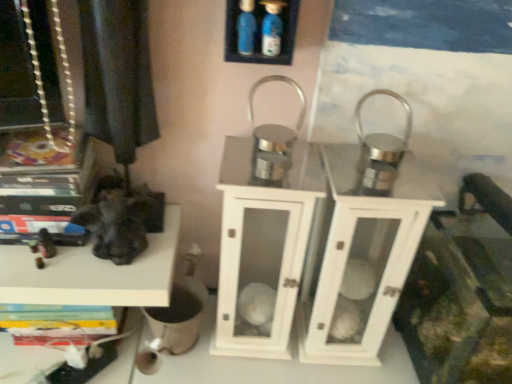
The height and width of the screenshot is (384, 512). What do you see at coordinates (260, 34) in the screenshot? I see `blue plastic bottles at upper center, which is the 2th shelf in bottom-to-top order` at bounding box center [260, 34].

The height and width of the screenshot is (384, 512). In order to click on blue plastic bottles at upper center, acting as the 2th shelf starting from the left in this screenshot , I will do `click(260, 34)`.

Considering the sizes of objects black matte statue at left, which is the first shelf from bottom to top, and white glossy lantern at center in the image provided, who is bigger, black matte statue at left, which is the first shelf from bottom to top, or white glossy lantern at center?

white glossy lantern at center.

What's the angular difference between black matte statue at left, which is the first shelf from bottom to top, and white glossy lantern at center's facing directions?

0.0246 degrees separate the facing orientations of black matte statue at left, which is the first shelf from bottom to top, and white glossy lantern at center.

Would you say white glossy lantern at center is part of black matte statue at left, which ranks as the second shelf in top-to-bottom order,'s contents?

Actually, white glossy lantern at center is outside black matte statue at left, which ranks as the second shelf in top-to-bottom order.

Is point (306, 320) positioned after point (286, 22)?

Yes, it is behind point (286, 22).

Based on their positions, is white glossy lantern at center located to the left or right of blue plastic bottles at upper center, the second shelf when ordered from back to front?

white glossy lantern at center is to the right of blue plastic bottles at upper center, the second shelf when ordered from back to front.

Is blue plastic bottles at upper center, which is the 2th shelf in bottom-to-top order, completely or partially inside white glossy lantern at center?

No, blue plastic bottles at upper center, which is the 2th shelf in bottom-to-top order, is located outside of white glossy lantern at center.

Can you confirm if blue plastic bottles at upper center, acting as the 2th shelf starting from the left, is shorter than white glossy lantern at center?

Indeed, blue plastic bottles at upper center, acting as the 2th shelf starting from the left, has a lesser height compared to white glossy lantern at center.

Does point (257, 53) appear closer or farther from the camera than point (385, 307)?

Clearly, point (257, 53) is closer to the camera than point (385, 307).

At what (x,y) coordinates should I click in order to perform the action: click on shelf above the white glossy lantern at center (from a real-world perspective). Please return your answer as a coordinate pair (x, y). The height and width of the screenshot is (384, 512). Looking at the image, I should click on (260, 34).

Measure the distance between blue plastic bottles at upper center, acting as the 2th shelf starting from the left, and white glossy lantern at center.

blue plastic bottles at upper center, acting as the 2th shelf starting from the left, is 16.22 inches from white glossy lantern at center.

From the image's perspective, between blue plastic bottles at upper center, acting as the 2th shelf starting from the left, and black matte statue at left, the second shelf in the right-to-left sequence, who is located below?

From the image's view, black matte statue at left, the second shelf in the right-to-left sequence, is below.

Is blue plastic bottles at upper center, the first shelf in the right-to-left sequence, looking in the opposite direction of black matte statue at left, which is the first shelf in back-to-front order?

No.

Would you say blue plastic bottles at upper center, the first shelf in the right-to-left sequence, is to the left or to the right of black matte statue at left, which ranks as the second shelf in top-to-bottom order, in the picture?

blue plastic bottles at upper center, the first shelf in the right-to-left sequence, is to the right of black matte statue at left, which ranks as the second shelf in top-to-bottom order.

Are blue plastic bottles at upper center, marked as the 1th shelf in a front-to-back arrangement, and black matte statue at left, which ranks as the second shelf in front-to-back order, far apart?

They are positioned close to each other.

Considering the relative positions of black matte statue at left, which is the first shelf in back-to-front order, and blue plastic bottles at upper center, acting as the 2th shelf starting from the left, in the image provided, is black matte statue at left, which is the first shelf in back-to-front order, to the left of blue plastic bottles at upper center, acting as the 2th shelf starting from the left, from the viewer's perspective?

Correct, you'll find black matte statue at left, which is the first shelf in back-to-front order, to the left of blue plastic bottles at upper center, acting as the 2th shelf starting from the left.

Based on the photo, which of these two, black matte statue at left, which ranks as the second shelf in front-to-back order, or blue plastic bottles at upper center, the first shelf in the right-to-left sequence, is bigger?

black matte statue at left, which ranks as the second shelf in front-to-back order.

How far apart are white glossy lantern at center and black matte statue at left, which is the first shelf in back-to-front order?

white glossy lantern at center is 12.64 inches from black matte statue at left, which is the first shelf in back-to-front order.

Is point (357, 201) closer to camera compared to point (28, 259)?

That is True.

Based on their positions, is white glossy lantern at center located to the left or right of black matte statue at left, which is the first shelf in back-to-front order?

From the image, it's evident that white glossy lantern at center is to the right of black matte statue at left, which is the first shelf in back-to-front order.

Is white glossy lantern at center closer to camera compared to black matte statue at left, which ranks as the second shelf in top-to-bottom order?

Yes, it is.

From the white glossy lantern at center, count the 2nd shelf to the left and point to it. Please provide its 2D coordinates.

[(93, 273)]

Locate an element on the screen. Image resolution: width=512 pixels, height=384 pixels. dresser on the right of blue plastic bottles at upper center, marked as the 1th shelf in a front-to-back arrangement is located at coordinates (321, 248).

Based on their spatial positions, is white glossy lantern at center or blue plastic bottles at upper center, the second shelf when ordered from back to front, further from black matte statue at left, which is the first shelf from bottom to top?

Among the two, blue plastic bottles at upper center, the second shelf when ordered from back to front, is located further to black matte statue at left, which is the first shelf from bottom to top.

Considering their positions, is black matte statue at left, which ranks as the second shelf in top-to-bottom order, positioned further to blue plastic bottles at upper center, the second shelf when ordered from back to front, than white glossy lantern at center?

black matte statue at left, which ranks as the second shelf in top-to-bottom order, is further to blue plastic bottles at upper center, the second shelf when ordered from back to front.

Looking at the image, which one is located further to blue plastic bottles at upper center, which is the first shelf from top to bottom, white glossy lantern at center or black matte statue at left, which is the first shelf from bottom to top?

black matte statue at left, which is the first shelf from bottom to top.

Looking at the image, which one is located further to white glossy lantern at center, black matte statue at left, which is the first shelf from bottom to top, or blue plastic bottles at upper center, acting as the 2th shelf starting from the left?

The object further to white glossy lantern at center is blue plastic bottles at upper center, acting as the 2th shelf starting from the left.

Consider the image. From the image, which object appears to be nearer to white glossy lantern at center, blue plastic bottles at upper center, the first shelf in the right-to-left sequence, or black matte statue at left, which ranks as the second shelf in front-to-back order?

The object closer to white glossy lantern at center is black matte statue at left, which ranks as the second shelf in front-to-back order.

Which object lies nearer to the anchor point black matte statue at left, the first shelf when ordered from left to right, blue plastic bottles at upper center, the first shelf in the right-to-left sequence, or white glossy lantern at center?

white glossy lantern at center lies closer to black matte statue at left, the first shelf when ordered from left to right, than the other object.

In order to click on shelf located between black matte statue at left, which is the first shelf in back-to-front order, and white glossy lantern at center in the left-right direction in this screenshot , I will do `click(260, 34)`.